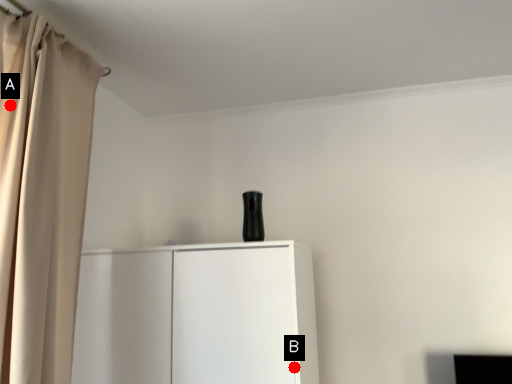
Question: Two points are circled on the image, labeled by A and B beside each circle. Which point is further to the camera?

Choices:
 (A) A is further
 (B) B is further

Answer: (B)